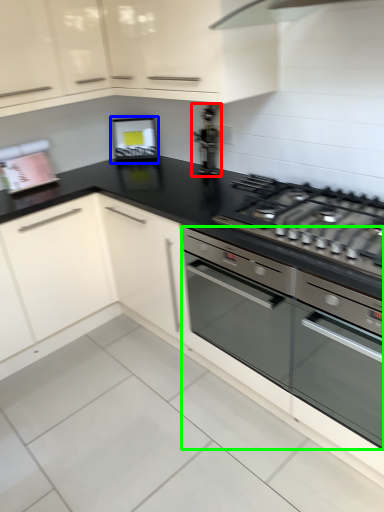
Question: Based on their relative distances, which object is nearer to appliance (highlighted by a red box)? Choose from appliance (highlighted by a blue box) and home appliance (highlighted by a green box).

Choices:
 (A) appliance
 (B) home appliance

Answer: (A)